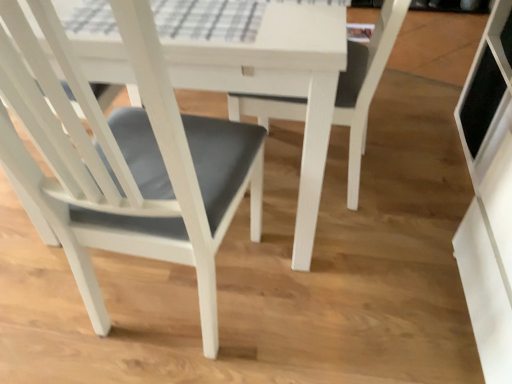
Question: Is matte gray cushion at center, which is counted as the 1th chair, starting from the right, touching matte gray cushion at center, placed as the second chair when sorted from right to left?

Choices:
 (A) no
 (B) yes

Answer: (A)

Question: Can we say matte gray cushion at center, positioned as the 2th chair in left-to-right order, lies outside matte gray cushion at center, positioned as the first chair in left-to-right order?

Choices:
 (A) no
 (B) yes

Answer: (A)

Question: Does matte gray cushion at center, positioned as the 2th chair in left-to-right order, contain matte gray cushion at center, placed as the second chair when sorted from right to left?

Choices:
 (A) yes
 (B) no

Answer: (B)

Question: From a real-world perspective, is matte gray cushion at center, positioned as the 2th chair in left-to-right order, below matte gray cushion at center, placed as the second chair when sorted from right to left?

Choices:
 (A) yes
 (B) no

Answer: (B)

Question: Does matte gray cushion at center, positioned as the 2th chair in left-to-right order, have a smaller size compared to matte gray cushion at center, positioned as the first chair in left-to-right order?

Choices:
 (A) no
 (B) yes

Answer: (B)

Question: From a real-world perspective, does matte gray cushion at center, positioned as the 2th chair in left-to-right order, stand above matte gray cushion at center, positioned as the first chair in left-to-right order?

Choices:
 (A) yes
 (B) no

Answer: (A)

Question: Can you confirm if matte gray cushion at center, placed as the second chair when sorted from right to left, is positioned to the left of matte gray cushion at center, positioned as the 2th chair in left-to-right order?

Choices:
 (A) no
 (B) yes

Answer: (B)

Question: Is matte gray cushion at center, positioned as the 2th chair in left-to-right order, at the back of matte gray cushion at center, positioned as the first chair in left-to-right order?

Choices:
 (A) yes
 (B) no

Answer: (A)

Question: Can you confirm if matte gray cushion at center, positioned as the first chair in left-to-right order, is positioned to the right of matte gray cushion at center, which is counted as the 1th chair, starting from the right?

Choices:
 (A) yes
 (B) no

Answer: (B)

Question: Considering the relative sizes of matte gray cushion at center, positioned as the first chair in left-to-right order, and matte gray cushion at center, positioned as the 2th chair in left-to-right order, in the image provided, is matte gray cushion at center, positioned as the first chair in left-to-right order, bigger than matte gray cushion at center, positioned as the 2th chair in left-to-right order,?

Choices:
 (A) yes
 (B) no

Answer: (A)

Question: From a real-world perspective, does matte gray cushion at center, positioned as the first chair in left-to-right order, sit lower than matte gray cushion at center, positioned as the 2th chair in left-to-right order?

Choices:
 (A) no
 (B) yes

Answer: (B)

Question: Does matte gray cushion at center, positioned as the first chair in left-to-right order, come behind matte gray cushion at center, positioned as the 2th chair in left-to-right order?

Choices:
 (A) yes
 (B) no

Answer: (B)

Question: Is matte gray cushion at center, positioned as the 2th chair in left-to-right order, in front of or behind matte gray cushion at center, placed as the second chair when sorted from right to left, in the image?

Choices:
 (A) behind
 (B) front

Answer: (A)